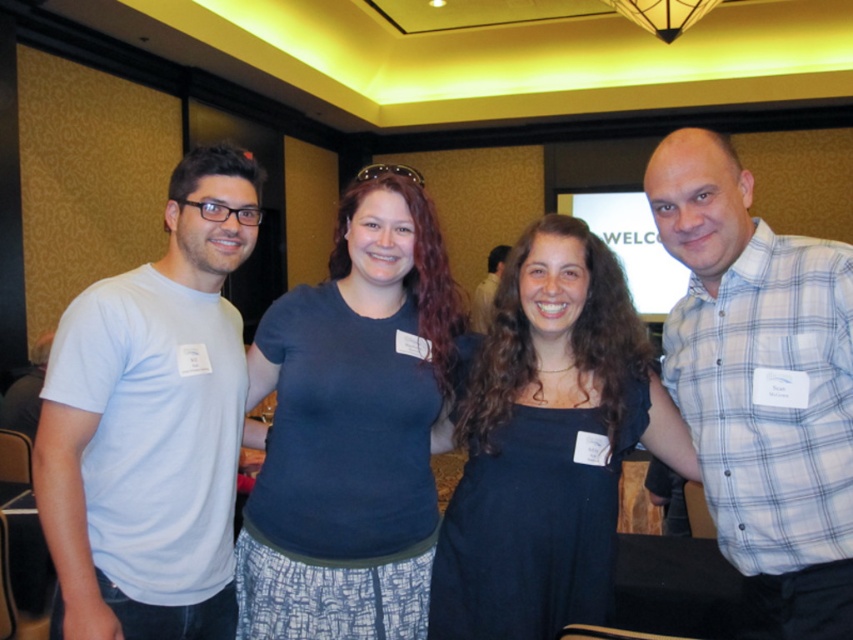
Question: Among these objects, which one is farthest from the camera?

Choices:
 (A) white matte t-shirt at left
 (B) matte white shirt at center

Answer: (B)

Question: Where is white matte t-shirt at left located in relation to matte white shirt at center in the image?

Choices:
 (A) below
 (B) above

Answer: (A)

Question: Is black dress at center to the left of matte white shirt at center from the viewer's perspective?

Choices:
 (A) yes
 (B) no

Answer: (A)

Question: Which object appears farthest from the camera in this image?

Choices:
 (A) white matte t-shirt at left
 (B) white checkered shirt at center
 (C) matte white shirt at center
 (D) black dress at center

Answer: (C)

Question: Considering the relative positions of white matte t-shirt at left and black dress at center in the image provided, where is white matte t-shirt at left located with respect to black dress at center?

Choices:
 (A) left
 (B) right

Answer: (A)

Question: Which of the following is the closest to the observer?

Choices:
 (A) (550, 506)
 (B) (370, 365)
 (C) (491, 289)
 (D) (657, 204)

Answer: (A)